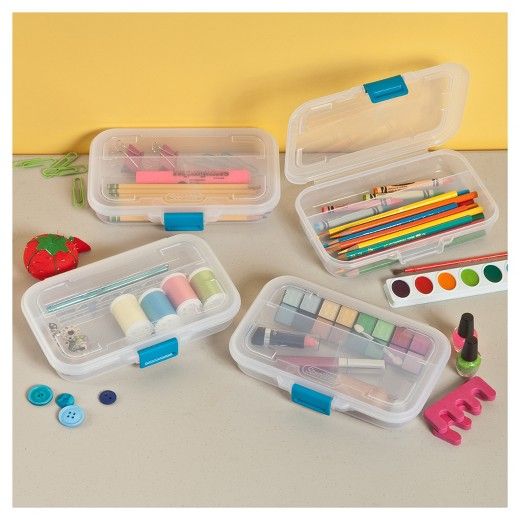
Locate an element on the screen. This screenshot has width=520, height=520. plastic container is located at coordinates (309, 312), (104, 328), (216, 145), (408, 211).